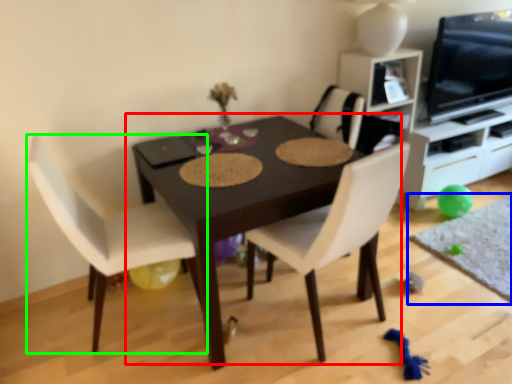
Question: Based on their relative distances, which object is nearer to table (highlighted by a red box)? Choose from place mat (highlighted by a blue box) and chair (highlighted by a green box).

Choices:
 (A) place mat
 (B) chair

Answer: (B)